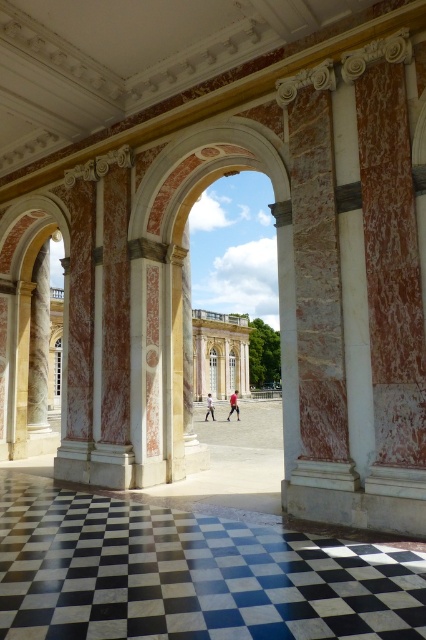
Which is above, black marble floor at center or red fabric pants at center?

black marble floor at center is higher up.

Is black marble floor at center taller than red fabric pants at center?

In fact, black marble floor at center may be shorter than red fabric pants at center.

Identify the location of black marble floor at center. (189, 573).

Is red fabric pants at center positioned before light brown leather jacket at center?

Yes.

Who is more forward, (232, 406) or (212, 416)?

Point (212, 416) is in front.

Identify the location of red fabric pants at center. Image resolution: width=426 pixels, height=640 pixels. (233, 404).

Locate an element on the screen. red fabric pants at center is located at coordinates (233, 404).

Can you confirm if black marble floor at center is taller than light brown leather jacket at center?

No.

The width and height of the screenshot is (426, 640). In order to click on black marble floor at center in this screenshot , I will do `click(189, 573)`.